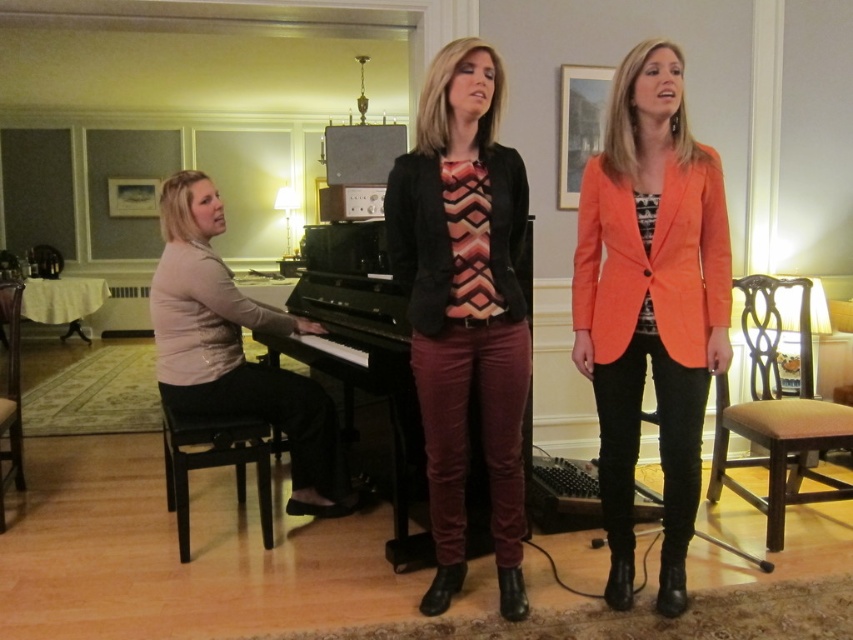
Is matte beige sweater at left thinner than black polished piano at center?

Correct, matte beige sweater at left's width is less than black polished piano at center's.

How distant is matte beige sweater at left from black polished piano at center?

The distance of matte beige sweater at left from black polished piano at center is 14.73 inches.

Who is more distant from viewer, (314, 404) or (387, 284)?

Point (387, 284)

This screenshot has height=640, width=853. What are the coordinates of `matte beige sweater at left` in the screenshot? It's located at (236, 349).

What do you see at coordinates (650, 305) in the screenshot? The height and width of the screenshot is (640, 853). I see `orange fabric blazer at center` at bounding box center [650, 305].

What do you see at coordinates (650, 305) in the screenshot? I see `orange fabric blazer at center` at bounding box center [650, 305].

In order to click on orange fabric blazer at center in this screenshot , I will do `click(650, 305)`.

Which is below, matte beige sweater at left or black wood stool at lower left?

black wood stool at lower left is below.

Can you confirm if matte beige sweater at left is positioned below black wood stool at lower left?

No, matte beige sweater at left is not below black wood stool at lower left.

Which is behind, point (268, 387) or point (178, 440)?

Point (268, 387)

Identify the location of matte beige sweater at left. (236, 349).